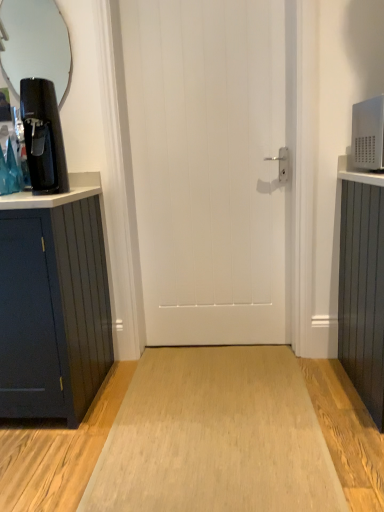
Measure the distance between matte black coffee machine at left and camera.

The depth of matte black coffee machine at left is 1.60 meters.

What is the approximate height of matte black coffee machine at left?

It is 17.14 inches.

This screenshot has height=512, width=384. Find the location of `clear glass mirror at upper left`. clear glass mirror at upper left is located at coordinates (36, 44).

I want to click on matte black coffee machine at left, so click(x=43, y=136).

From the image's perspective, would you say clear glass mirror at upper left is positioned over light wood floor at center?

Indeed, from the image's perspective, clear glass mirror at upper left is shown above light wood floor at center.

Is clear glass mirror at upper left shorter than light wood floor at center?

Incorrect, the height of clear glass mirror at upper left does not fall short of that of light wood floor at center.

Locate an element on the screen. The width and height of the screenshot is (384, 512). plain lying on the right of clear glass mirror at upper left is located at coordinates (215, 437).

Is clear glass mirror at upper left not inside light wood floor at center?

Yes, clear glass mirror at upper left is outside of light wood floor at center.

The width and height of the screenshot is (384, 512). I want to click on door below the matte black coffee machine at left (from a real-world perspective), so click(210, 167).

Based on the photo, would you say white matte door at center is outside matte black coffee machine at left?

Indeed, white matte door at center is completely outside matte black coffee machine at left.

Does white matte door at center turn towards matte black coffee machine at left?

No, white matte door at center does not turn towards matte black coffee machine at left.

Considering the positions of points (45, 36) and (242, 74), is point (45, 36) farther from camera compared to point (242, 74)?

Yes, it is behind point (242, 74).

Is clear glass mirror at upper left placed right next to white matte door at center?

There is a gap between clear glass mirror at upper left and white matte door at center.

Between clear glass mirror at upper left and white matte door at center, which one appears on the left side from the viewer's perspective?

clear glass mirror at upper left is more to the left.

How far apart are clear glass mirror at upper left and white matte door at center?

They are 5.89 feet apart.

Does matte black coffee machine at left lie in front of light wood floor at center?

That is False.

Considering the positions of objects matte black coffee machine at left and light wood floor at center in the image provided, who is more to the left, matte black coffee machine at left or light wood floor at center?

matte black coffee machine at left is more to the left.

Image resolution: width=384 pixels, height=512 pixels. Find the location of `plain lying on the right of matte black coffee machine at left`. plain lying on the right of matte black coffee machine at left is located at coordinates (215, 437).

From a real-world perspective, is clear glass mirror at upper left over matte black coffee machine at left?

Yes, from a real-world perspective, clear glass mirror at upper left is on top of matte black coffee machine at left.

How far apart are clear glass mirror at upper left and matte black coffee machine at left?

clear glass mirror at upper left and matte black coffee machine at left are 5.49 feet apart from each other.

Based on their sizes in the image, would you say clear glass mirror at upper left is bigger or smaller than matte black coffee machine at left?

clear glass mirror at upper left is smaller than matte black coffee machine at left.

Based on the photo, which object is closer to the camera, clear glass mirror at upper left or matte black coffee machine at left?

matte black coffee machine at left is closer to the camera.

Which of these two, light wood floor at center or clear glass mirror at upper left, is thinner?

clear glass mirror at upper left is thinner.

From the image's perspective, is light wood floor at center located beneath clear glass mirror at upper left?

Yes, from the image's perspective, light wood floor at center is below clear glass mirror at upper left.

Is light wood floor at center to the left or to the right of clear glass mirror at upper left in the image?

Based on their positions, light wood floor at center is located to the right of clear glass mirror at upper left.

Which is in front, point (213, 404) or point (40, 96)?

Positioned in front is point (40, 96).

Between light wood floor at center and matte black coffee machine at left, which one appears on the left side from the viewer's perspective?

matte black coffee machine at left is more to the left.

Is light wood floor at center positioned with its back to matte black coffee machine at left?

light wood floor at center is not turned away from matte black coffee machine at left.

How many degrees apart are the facing directions of light wood floor at center and matte black coffee machine at left?

0.639 degrees separate the facing orientations of light wood floor at center and matte black coffee machine at left.

This screenshot has height=512, width=384. Identify the location of plain that is on the right side of clear glass mirror at upper left. (215, 437).

The width and height of the screenshot is (384, 512). Find the location of `coffee machine above the white matte door at center (from a real-world perspective)`. coffee machine above the white matte door at center (from a real-world perspective) is located at coordinates click(43, 136).

Estimate the real-world distances between objects in this image. Which object is further from clear glass mirror at upper left, white matte door at center or light wood floor at center?

Based on the image, light wood floor at center appears to be further to clear glass mirror at upper left.

Estimate the real-world distances between objects in this image. Which object is further from clear glass mirror at upper left, light wood floor at center or white matte door at center?

Among the two, light wood floor at center is located further to clear glass mirror at upper left.

Which object lies further to the anchor point light wood floor at center, white matte door at center or clear glass mirror at upper left?

clear glass mirror at upper left lies further to light wood floor at center than the other object.

Which object lies nearer to the anchor point white matte door at center, light wood floor at center or matte black coffee machine at left?

matte black coffee machine at left is closer to white matte door at center.

Looking at the image, which one is located closer to light wood floor at center, matte black coffee machine at left or white matte door at center?

white matte door at center is positioned closer to the anchor light wood floor at center.

Estimate the real-world distances between objects in this image. Which object is closer to matte black coffee machine at left, light wood floor at center or white matte door at center?

white matte door at center is positioned closer to the anchor matte black coffee machine at left.

Which object lies further to the anchor point clear glass mirror at upper left, light wood floor at center or matte black coffee machine at left?

light wood floor at center is positioned further to the anchor clear glass mirror at upper left.

Based on their spatial positions, is matte black coffee machine at left or white matte door at center further from clear glass mirror at upper left?

white matte door at center lies further to clear glass mirror at upper left than the other object.

Image resolution: width=384 pixels, height=512 pixels. What are the coordinates of `coffee machine between clear glass mirror at upper left and light wood floor at center vertically` in the screenshot? It's located at (43, 136).

Find the location of a particular element. This screenshot has height=512, width=384. door that lies between clear glass mirror at upper left and light wood floor at center from top to bottom is located at coordinates (210, 167).

Where is `door that lies between matte black coffee machine at left and light wood floor at center from top to bottom`? The width and height of the screenshot is (384, 512). door that lies between matte black coffee machine at left and light wood floor at center from top to bottom is located at coordinates (210, 167).

Where is `coffee machine situated between clear glass mirror at upper left and white matte door at center from left to right`? coffee machine situated between clear glass mirror at upper left and white matte door at center from left to right is located at coordinates (43, 136).